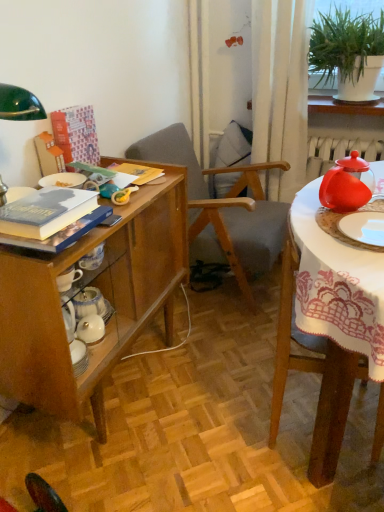
In order to click on wooden chair at center, marked as the second chair in a front-to-back arrangement in this screenshot , I will do `click(222, 210)`.

Image resolution: width=384 pixels, height=512 pixels. What are the coordinates of `green leafy plant at upper right` in the screenshot? It's located at (348, 52).

In order to face hardcover book at upper left, acting as the 2th book starting from the bottom, should I rotate leftwards or rightwards?

To face it directly, rotate left by 14.978 degrees.

Measure the distance between point [48,237] and camera.

They are 38.58 inches apart.

This screenshot has height=512, width=384. I want to click on wooden desk at left, so click(x=104, y=296).

Describe the element at coordinates (104, 296) in the screenshot. I see `wooden desk at left` at that location.

What are the coordinates of `wooden chair at right, the second chair in the back-to-front sequence` in the screenshot? It's located at (313, 372).

From a real-world perspective, is white sheer curtain at upper right physically located above or below shiny red teapot at right, which ranks as the 2th tableware in bottom-to-top order?

In terms of real-world spatial position, white sheer curtain at upper right is below shiny red teapot at right, which ranks as the 2th tableware in bottom-to-top order.

Is white sheer curtain at upper right looking in the opposite direction of shiny red teapot at right, marked as the 1th tableware in a top-to-bottom arrangement?

No, white sheer curtain at upper right is not facing the opposite direction of shiny red teapot at right, marked as the 1th tableware in a top-to-bottom arrangement.

In the scene shown: Could shiny red teapot at right, which ranks as the 2th tableware in bottom-to-top order, be considered to be inside white sheer curtain at upper right?

Definitely not — shiny red teapot at right, which ranks as the 2th tableware in bottom-to-top order, is not inside white sheer curtain at upper right.

Does point (282, 61) appear closer or farther from the camera than point (347, 158)?

Point (282, 61) appears to be farther away from the viewer than point (347, 158).

Considering the points (195, 259) and (260, 106), which point is behind, point (195, 259) or point (260, 106)?

Positioned behind is point (195, 259).

Considering the relative positions of wooden chair at center, marked as the second chair in a front-to-back arrangement, and white sheer curtain at upper right in the image provided, is wooden chair at center, marked as the second chair in a front-to-back arrangement, to the left of white sheer curtain at upper right from the viewer's perspective?

Yes.

Who is taller, wooden chair at center, acting as the first chair starting from the back, or white sheer curtain at upper right?

white sheer curtain at upper right.

Based on the photo, could you measure the distance between wooden chair at center, acting as the first chair starting from the back, and white sheer curtain at upper right?

14.74 inches.

Is hardcover book at upper left, the first book positioned from the back, turned away from wooden desk at left?

hardcover book at upper left, the first book positioned from the back, is not turned away from wooden desk at left.

Is hardcover book at upper left, acting as the 2th book starting from the bottom, to the left or to the right of wooden desk at left in the image?

Clearly, hardcover book at upper left, acting as the 2th book starting from the bottom, is on the left of wooden desk at left in the image.

Consider the image. Considering the sizes of objects hardcover book at upper left, which ranks as the second book in front-to-back order, and wooden desk at left in the image provided, who is shorter, hardcover book at upper left, which ranks as the second book in front-to-back order, or wooden desk at left?

Standing shorter between the two is hardcover book at upper left, which ranks as the second book in front-to-back order.

How many degrees apart are the facing directions of hardcover book at upper left, the first book positioned from the back, and wooden desk at left?

The facing directions of hardcover book at upper left, the first book positioned from the back, and wooden desk at left are 0.421 degrees apart.

Does hardcover book at left, the second book from the back, turn towards white glossy plate at right, arranged as the 1th tableware when ordered from the bottom?

Yes, hardcover book at left, the second book from the back, is turned towards white glossy plate at right, arranged as the 1th tableware when ordered from the bottom.

Looking at this image, which object is positioned more to the right, hardcover book at left, the second book from the back, or white glossy plate at right, arranged as the second tableware when viewed from the top?

Positioned to the right is white glossy plate at right, arranged as the second tableware when viewed from the top.

Is point (0, 222) closer or farther from the camera than point (361, 231)?

Point (0, 222).

Is wooden chair at center, marked as the second chair in a front-to-back arrangement, oriented towards hardcover book at upper left, acting as the 2th book starting from the bottom?

No.

Does wooden chair at center, acting as the first chair starting from the back, come in front of hardcover book at upper left, acting as the 2th book starting from the bottom?

No, it is not.

Who is shorter, wooden chair at center, marked as the second chair in a front-to-back arrangement, or hardcover book at upper left, acting as the 2th book starting from the bottom?

With less height is hardcover book at upper left, acting as the 2th book starting from the bottom.

Which is correct: wooden chair at center, acting as the first chair starting from the back, is inside hardcover book at upper left, acting as the 2th book starting from the bottom, or outside of it?

wooden chair at center, acting as the first chair starting from the back, is outside hardcover book at upper left, acting as the 2th book starting from the bottom.

Is wooden chair at center, acting as the first chair starting from the back, facing away from wooden desk at left?

wooden chair at center, acting as the first chair starting from the back, is not turned away from wooden desk at left.

In terms of width, does wooden chair at center, acting as the first chair starting from the back, look wider or thinner when compared to wooden desk at left?

Considering their sizes, wooden chair at center, acting as the first chair starting from the back, looks broader than wooden desk at left.

Does point (212, 173) come behind point (101, 359)?

Yes, it is behind point (101, 359).

In terms of size, does wooden chair at center, marked as the second chair in a front-to-back arrangement, appear bigger or smaller than wooden desk at left?

Clearly, wooden chair at center, marked as the second chair in a front-to-back arrangement, is larger in size than wooden desk at left.

In the scene shown: From the image's perspective, is hardcover book at upper left, acting as the 2th book starting from the bottom, on top of wooden chair at center, marked as the second chair in a front-to-back arrangement?

Indeed, from the image's perspective, hardcover book at upper left, acting as the 2th book starting from the bottom, is shown above wooden chair at center, marked as the second chair in a front-to-back arrangement.

Which is in front, hardcover book at upper left, acting as the 2th book starting from the bottom, or wooden chair at center, acting as the first chair starting from the back?

Positioned in front is hardcover book at upper left, acting as the 2th book starting from the bottom.

Image resolution: width=384 pixels, height=512 pixels. In order to click on book that is the 1st one when counting forward from the wooden chair at center, marked as the second chair in a front-to-back arrangement in this screenshot , I will do click(76, 134).

In order to click on the 1st tableware below the white sheer curtain at upper right (from the image's perspective) in this screenshot , I will do `click(347, 184)`.

Identify the location of curtain above the wooden chair at center, acting as the first chair starting from the back (from a real-world perspective). Image resolution: width=384 pixels, height=512 pixels. (280, 90).

Looking at the image, which one is located closer to wooden desk at left, green leafy plant at upper right or hardcover book at upper left, the first book positioned from the back?

hardcover book at upper left, the first book positioned from the back, lies closer to wooden desk at left than the other object.

Based on the photo, looking at the image, which one is located closer to wooden chair at right, the second chair in the back-to-front sequence, white sheer curtain at upper right or wooden chair at center, acting as the first chair starting from the back?

wooden chair at center, acting as the first chair starting from the back, is closer to wooden chair at right, the second chair in the back-to-front sequence.

Considering their positions, is wooden chair at center, acting as the first chair starting from the back, positioned further to white sheer curtain at upper right than white glossy plate at right, arranged as the second tableware when viewed from the top?

white glossy plate at right, arranged as the second tableware when viewed from the top, is positioned further to the anchor white sheer curtain at upper right.

Looking at the image, which one is located further to wooden desk at left, wooden chair at right, the second chair in the back-to-front sequence, or green leafy plant at upper right?

The object further to wooden desk at left is green leafy plant at upper right.

Estimate the real-world distances between objects in this image. Which object is closer to hardcover book at left, which is counted as the 2th book, starting from the top, wooden chair at right, the 1th chair positioned from the front, or wooden chair at center, marked as the second chair in a front-to-back arrangement?

wooden chair at right, the 1th chair positioned from the front, is closer to hardcover book at left, which is counted as the 2th book, starting from the top.

Considering their positions, is shiny red teapot at right, marked as the 1th tableware in a top-to-bottom arrangement, positioned further to hardcover book at left, which is the first book in front-to-back order, than white glossy plate at right, arranged as the second tableware when viewed from the top?

white glossy plate at right, arranged as the second tableware when viewed from the top, is further to hardcover book at left, which is the first book in front-to-back order.

Which object lies further to the anchor point shiny red teapot at right, which ranks as the 2th tableware in bottom-to-top order, wooden chair at center, acting as the first chair starting from the back, or wooden chair at right, the second chair in the back-to-front sequence?

wooden chair at center, acting as the first chair starting from the back, is further to shiny red teapot at right, which ranks as the 2th tableware in bottom-to-top order.

Based on their spatial positions, is wooden desk at left or shiny red teapot at right, marked as the 1th tableware in a top-to-bottom arrangement, further from wooden chair at right, the 1th chair positioned from the front?

wooden desk at left.

At what (x,y) coordinates should I click in order to perform the action: click on chair between green leafy plant at upper right and shiny red teapot at right, which ranks as the 2th tableware in bottom-to-top order, from top to bottom. Please return your answer as a coordinate pair (x, y). Image resolution: width=384 pixels, height=512 pixels. Looking at the image, I should click on (222, 210).

Where is `tableware between white glossy plate at right, arranged as the 1th tableware when ordered from the bottom, and white sheer curtain at upper right in the front-back direction`? Image resolution: width=384 pixels, height=512 pixels. tableware between white glossy plate at right, arranged as the 1th tableware when ordered from the bottom, and white sheer curtain at upper right in the front-back direction is located at coordinates (347, 184).

This screenshot has width=384, height=512. I want to click on book between wooden desk at left and wooden chair at center, acting as the first chair starting from the back, in the front-back direction, so click(x=76, y=134).

You are a GUI agent. You are given a task and a screenshot of the screen. Output one action in this format:
    pyautogui.click(x=<x>, y=<y>)
    Task: Click on the curtain between green leafy plant at upper right and wooden chair at center, acting as the first chair starting from the back, in the up-down direction
    The width and height of the screenshot is (384, 512).
    Given the screenshot: What is the action you would take?
    pyautogui.click(x=280, y=90)